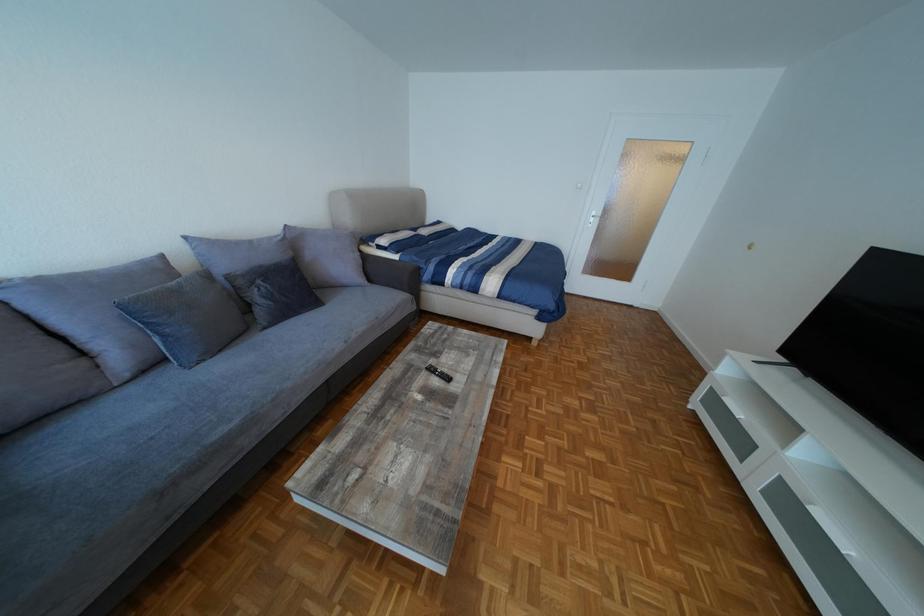
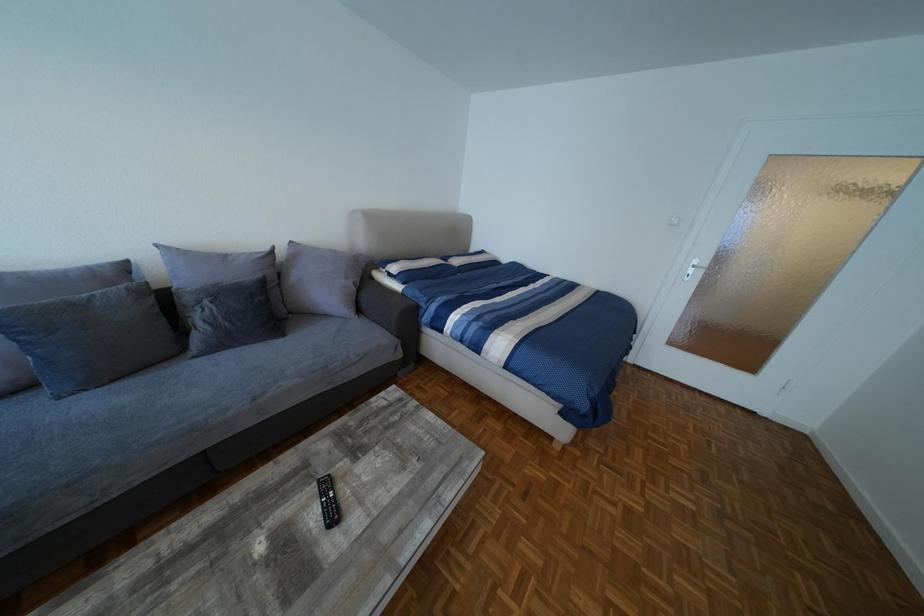
Question: The images are taken continuously from a first-person perspective. In which direction is your viewpoint rotating?

Choices:
 (A) Left
 (B) Right
 (C) Up
 (D) Down

Answer: (A)